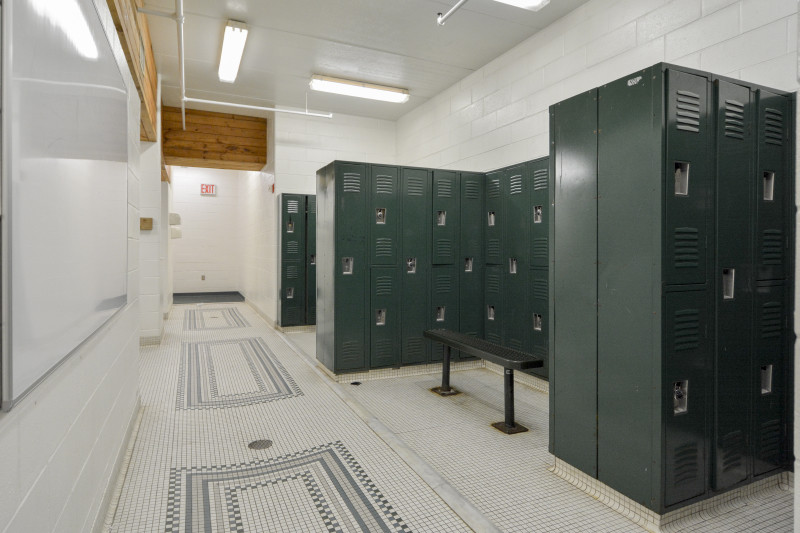
Identify the location of floor. (309, 424).